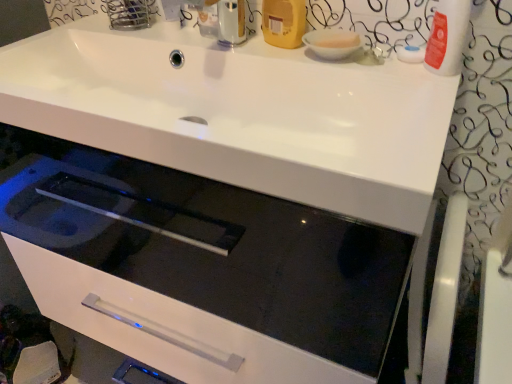
What do you see at coordinates (284, 22) in the screenshot? I see `yellow matte plastic bottle at upper right` at bounding box center [284, 22].

Where is `yellow matte plastic bottle at upper right`? The width and height of the screenshot is (512, 384). yellow matte plastic bottle at upper right is located at coordinates (284, 22).

Identify the location of white ceramic bowl at upper right. (332, 43).

What do you see at coordinates (332, 43) in the screenshot? The width and height of the screenshot is (512, 384). I see `white ceramic bowl at upper right` at bounding box center [332, 43].

The image size is (512, 384). I want to click on yellow matte plastic bottle at upper right, so click(x=284, y=22).

Which is more to the right, white ceramic bowl at upper right or yellow matte plastic bottle at upper right?

white ceramic bowl at upper right.

Which object is further away from the camera, white ceramic bowl at upper right or yellow matte plastic bottle at upper right?

yellow matte plastic bottle at upper right is further from the camera.

Is point (321, 35) more distant than point (283, 18)?

Yes, it is.

From the image's perspective, which object appears higher, white ceramic bowl at upper right or yellow matte plastic bottle at upper right?

From the image's view, yellow matte plastic bottle at upper right is above.

From a real-world perspective, who is located lower, white ceramic bowl at upper right or yellow matte plastic bottle at upper right?

white ceramic bowl at upper right.

In terms of width, does white ceramic bowl at upper right look wider or thinner when compared to yellow matte plastic bottle at upper right?

In the image, white ceramic bowl at upper right appears to be wider than yellow matte plastic bottle at upper right.

Between white ceramic bowl at upper right and yellow matte plastic bottle at upper right, which one has more height?

yellow matte plastic bottle at upper right is taller.

Does white ceramic bowl at upper right have a larger size compared to yellow matte plastic bottle at upper right?

Incorrect, white ceramic bowl at upper right is not larger than yellow matte plastic bottle at upper right.

Which is correct: white ceramic bowl at upper right is inside yellow matte plastic bottle at upper right, or outside of it?

white ceramic bowl at upper right lies outside yellow matte plastic bottle at upper right.

Is white ceramic bowl at upper right touching yellow matte plastic bottle at upper right?

Yes, the surface of white ceramic bowl at upper right is in contact with yellow matte plastic bottle at upper right.

Is white ceramic bowl at upper right oriented towards yellow matte plastic bottle at upper right?

No, white ceramic bowl at upper right is not facing towards yellow matte plastic bottle at upper right.

Where is `basin to the right of yellow matte plastic bottle at upper right`? The width and height of the screenshot is (512, 384). basin to the right of yellow matte plastic bottle at upper right is located at coordinates (332, 43).

Is yellow matte plastic bottle at upper right at the left side of white ceramic bowl at upper right?

Yes, yellow matte plastic bottle at upper right is to the left of white ceramic bowl at upper right.

Between yellow matte plastic bottle at upper right and white ceramic bowl at upper right, which one is positioned behind?

Positioned behind is yellow matte plastic bottle at upper right.

Consider the image. Which point is more forward, (281, 44) or (315, 30)?

The point (281, 44) is more forward.

From the image's perspective, which object appears higher, yellow matte plastic bottle at upper right or white ceramic bowl at upper right?

yellow matte plastic bottle at upper right, from the image's perspective.

In the scene shown: From a real-world perspective, is yellow matte plastic bottle at upper right physically below white ceramic bowl at upper right?

No, from a real-world perspective, yellow matte plastic bottle at upper right is not beneath white ceramic bowl at upper right.

From the picture: Does yellow matte plastic bottle at upper right have a lesser width compared to white ceramic bowl at upper right?

Indeed, yellow matte plastic bottle at upper right has a lesser width compared to white ceramic bowl at upper right.

Who is taller, yellow matte plastic bottle at upper right or white ceramic bowl at upper right?

With more height is yellow matte plastic bottle at upper right.

Based on their sizes in the image, would you say yellow matte plastic bottle at upper right is bigger or smaller than white ceramic bowl at upper right?

Clearly, yellow matte plastic bottle at upper right is larger in size than white ceramic bowl at upper right.

Is white ceramic bowl at upper right located within yellow matte plastic bottle at upper right?

No.

Would you say yellow matte plastic bottle at upper right is a long distance from white ceramic bowl at upper right?

No.

Is yellow matte plastic bottle at upper right turned away from white ceramic bowl at upper right?

That's not correct — yellow matte plastic bottle at upper right is not looking away from white ceramic bowl at upper right.

Measure the distance from yellow matte plastic bottle at upper right to white ceramic bowl at upper right.

They are 2.32 inches apart.

What are the coordinates of `basin below the yellow matte plastic bottle at upper right (from the image's perspective)` in the screenshot? It's located at (332, 43).

In the image, there is a white ceramic bowl at upper right. Identify the location of toiletry above it (from the image's perspective). Image resolution: width=512 pixels, height=384 pixels. (284, 22).

There is a white ceramic bowl at upper right. At what (x,y) coordinates should I click in order to perform the action: click on toiletry above it (from a real-world perspective). Please return your answer as a coordinate pair (x, y). The width and height of the screenshot is (512, 384). Looking at the image, I should click on (284, 22).